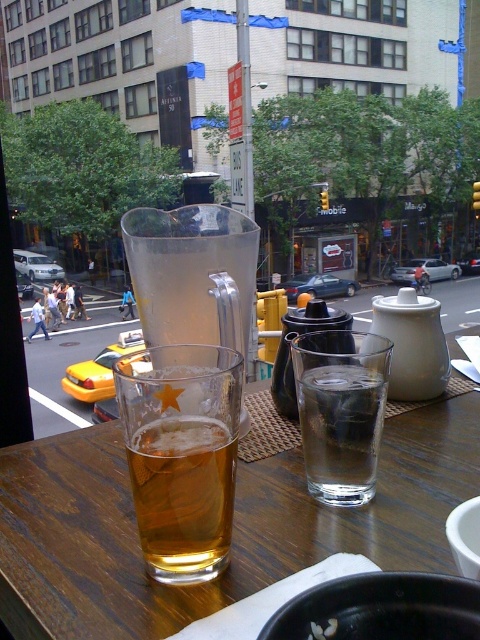
Based on the photo, you are a customer sitting at the wooden table at center in a busy restaurant. You want to reach the yellow matte taxi at lower left to grab a napkin. Is the taxi within your immediate reach without moving your chair?

The wooden table at center is above the yellow matte taxi at lower left, so the taxi is positioned below the table. Since the taxi is under the table, it should be within reach without moving your chair.

You are a customer at this table and want to place your phone on the table. The phone has a width of 0.1 units. Can you place it to the right of the translucent glass beer at center without overlapping any other objects?

The translucent glass beer at center is located at point (181, 454). Since there are no objects mentioned to the right of it in the scene description, you can place the phone there as long as there is enough space. However, the exact availability depends on the table layout beyond the described objects.